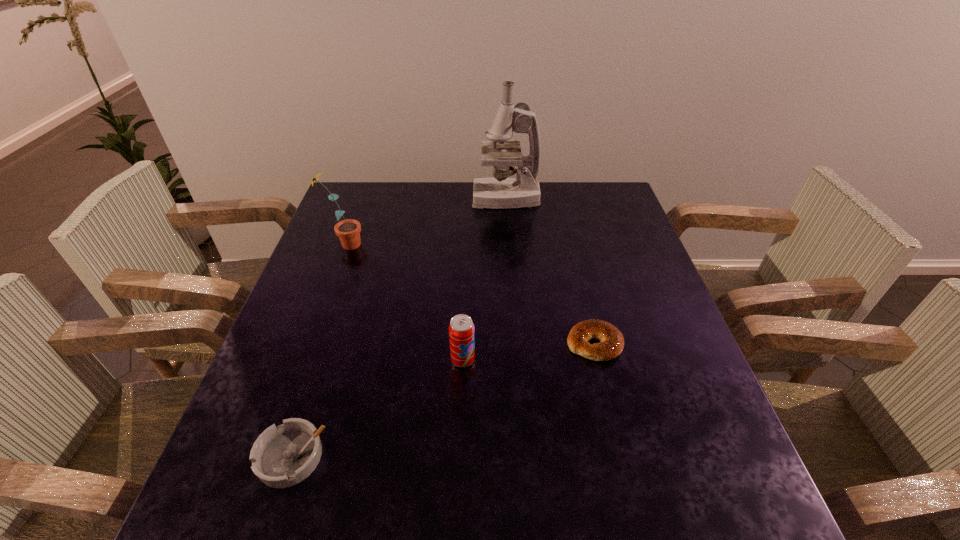
I want to click on free area in between the bagel and the nearest object, so click(443, 400).

You are a GUI agent. You are given a task and a screenshot of the screen. Output one action in this format:
    pyautogui.click(x=<x>, y=<y>)
    Task: Click on the free space between the third shortest object and the second tallest object
    The width and height of the screenshot is (960, 540).
    Given the screenshot: What is the action you would take?
    pyautogui.click(x=403, y=302)

Point out which object is positioned as the fourth nearest to the fourth nearest object. Please provide its 2D coordinates. Your answer should be formatted as a tuple, i.e. [(x, y)], where the tuple contains the x and y coordinates of a point satisfying the conditions above.

[(611, 344)]

You are a GUI agent. You are given a task and a screenshot of the screen. Output one action in this format:
    pyautogui.click(x=<x>, y=<y>)
    Task: Click on the object that is the third closest to the ashtray
    This screenshot has height=540, width=960.
    Given the screenshot: What is the action you would take?
    click(x=348, y=231)

Locate an element on the screen. The height and width of the screenshot is (540, 960). free space that satisfies the following two spatial constraints: 1. on the flower of the fourth nearest object; 2. on the left side of the ashtray is located at coordinates pos(265,457).

Locate an element on the screen. This screenshot has height=540, width=960. vacant space that satisfies the following two spatial constraints: 1. on the flower of the second tallest object; 2. on the left side of the nearest object is located at coordinates (265, 457).

Find the location of a particular element. free point that satisfies the following two spatial constraints: 1. on the back side of the nearest object; 2. on the right side of the soda can is located at coordinates (323, 360).

The image size is (960, 540). I want to click on vacant position in the image that satisfies the following two spatial constraints: 1. on the flower of the nearest object; 2. on the right side of the fourth shortest object, so click(x=265, y=457).